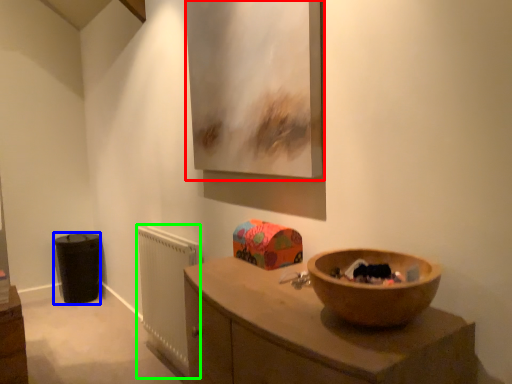
Question: Which object is the farthest from picture frame (highlighted by a red box)? Choose among these: cabinetry (highlighted by a blue box) or radiator (highlighted by a green box).

Choices:
 (A) cabinetry
 (B) radiator

Answer: (A)